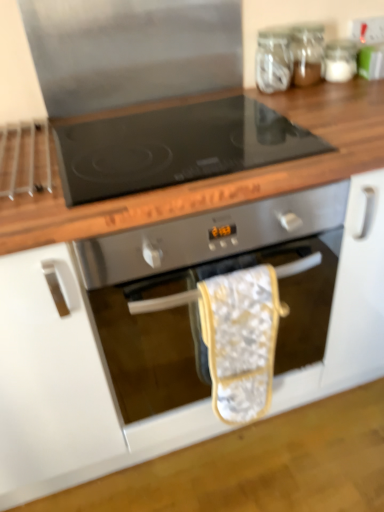
Question: From the image's perspective, is stainless steel oven at center above or below wooden at upper center?

Choices:
 (A) below
 (B) above

Answer: (A)

Question: Is stainless steel oven at center in front of or behind wooden at upper center in the image?

Choices:
 (A) behind
 (B) front

Answer: (A)

Question: Based on their relative distances, which object is farther from the white fabric oven mitt at center?

Choices:
 (A) wooden at upper center
 (B) transparent glass jar at upper right, which appears as the second glass jar when viewed from the right
 (C) stainless steel oven at center
 (D) transparent glass jar at upper right, the third glass jar in the left-to-right sequence
 (E) transparent glass jar at upper right, positioned as the 3th glass jar in right-to-left order

Answer: (D)

Question: Estimate the real-world distances between objects in this image. Which object is farther from the transparent glass jar at upper right, placed as the 2th glass jar when sorted from left to right?

Choices:
 (A) white fabric oven mitt at center
 (B) transparent glass jar at upper right, marked as the 1th glass jar in a right-to-left arrangement
 (C) stainless steel oven at center
 (D) transparent glass jar at upper right, positioned as the 3th glass jar in right-to-left order
 (E) wooden at upper center

Answer: (A)